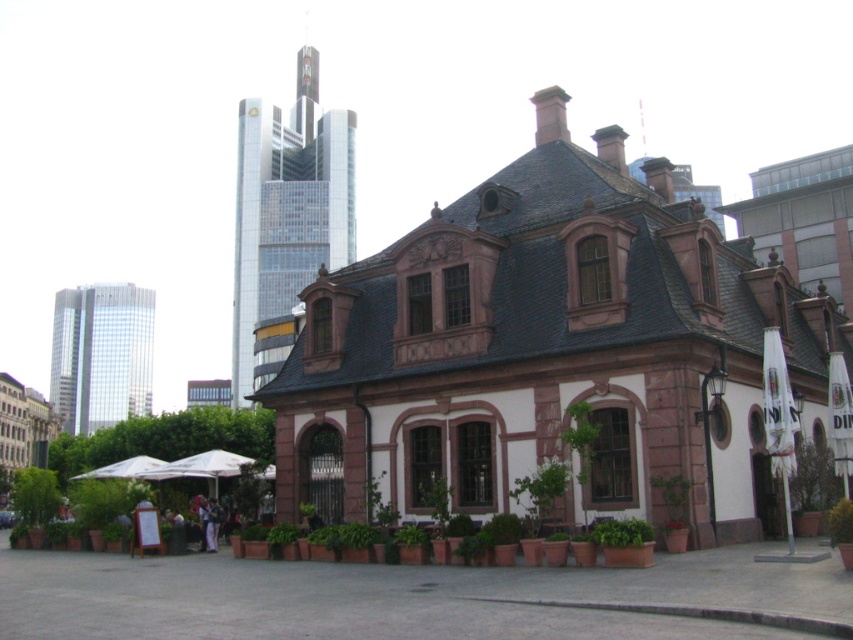
Question: Which point is farther to the camera?

Choices:
 (A) white fabric umbrella at right
 (B) pink stone building at center

Answer: (B)

Question: Observing the image, what is the correct spatial positioning of pink stone building at center in reference to white fabric umbrella at right?

Choices:
 (A) below
 (B) above

Answer: (B)

Question: Which point is closer to the camera?

Choices:
 (A) pink stone building at center
 (B) white fabric umbrella at right

Answer: (B)

Question: Is pink stone building at center positioned at the back of white fabric umbrella at right?

Choices:
 (A) no
 (B) yes

Answer: (B)

Question: Which of the following is the farthest from the observer?

Choices:
 (A) (780, 400)
 (B) (401, 240)

Answer: (B)

Question: Is pink stone building at center positioned at the back of white fabric umbrella at right?

Choices:
 (A) no
 (B) yes

Answer: (B)